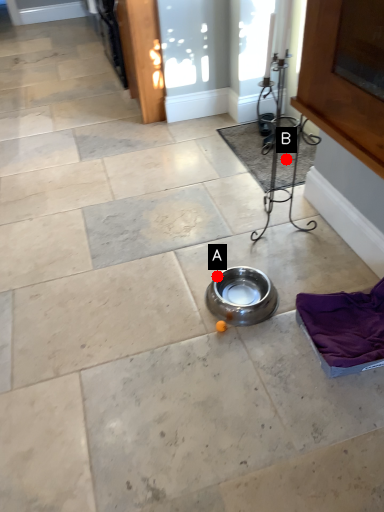
Question: Two points are circled on the image, labeled by A and B beside each circle. Which point is further to the camera?

Choices:
 (A) A is further
 (B) B is further

Answer: (B)